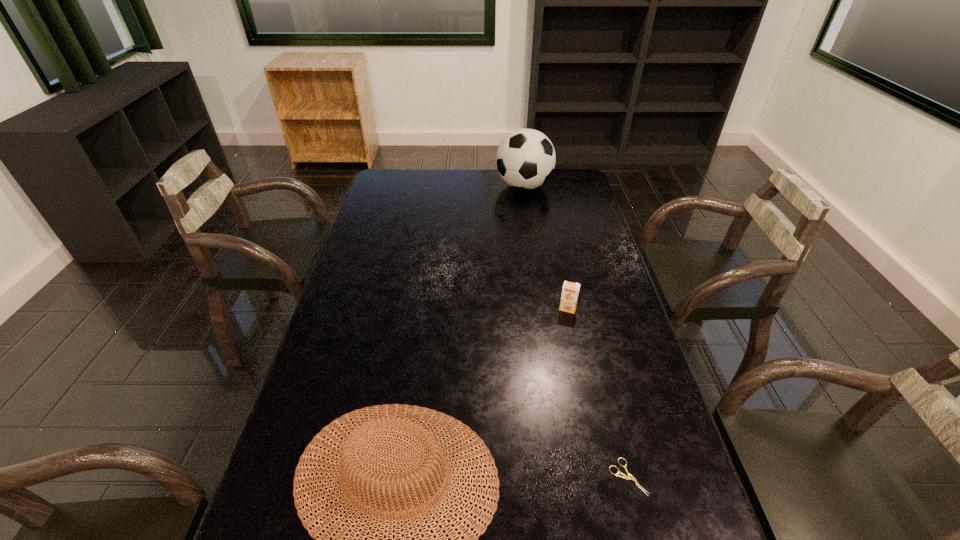
Where is `the tallest object`? The height and width of the screenshot is (540, 960). the tallest object is located at coordinates (525, 159).

This screenshot has height=540, width=960. I want to click on soccer ball, so click(x=525, y=159).

Image resolution: width=960 pixels, height=540 pixels. I want to click on the third nearest object, so click(570, 290).

Locate an element on the screen. The height and width of the screenshot is (540, 960). orange juice is located at coordinates (570, 290).

I want to click on shears, so click(x=624, y=476).

What are the coordinates of `vacant space located 0.090m on the front of the tallest object` in the screenshot? It's located at (528, 213).

Find the location of a particular element. The image size is (960, 540). vacant space located 0.300m on the left of the orange juice is located at coordinates (461, 308).

The height and width of the screenshot is (540, 960). In order to click on vacant space located 0.280m on the left of the shears in this screenshot , I will do [482, 477].

What are the coordinates of `object that is at the far edge` in the screenshot? It's located at (525, 159).

Locate an element on the screen. soccer ball that is at the right edge is located at coordinates (525, 159).